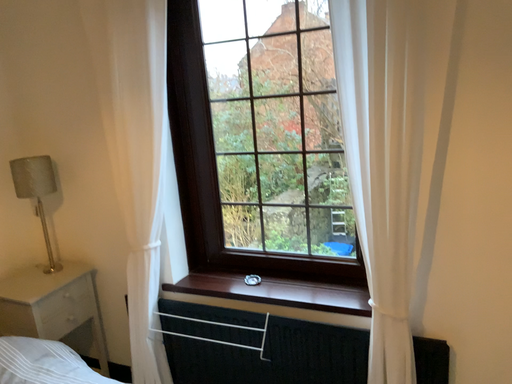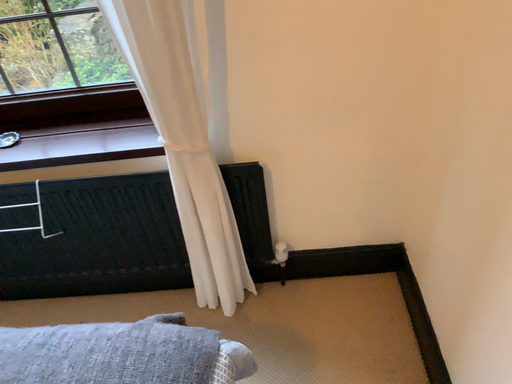
Question: Which way did the camera rotate in the video?

Choices:
 (A) rotated right
 (B) rotated left

Answer: (A)